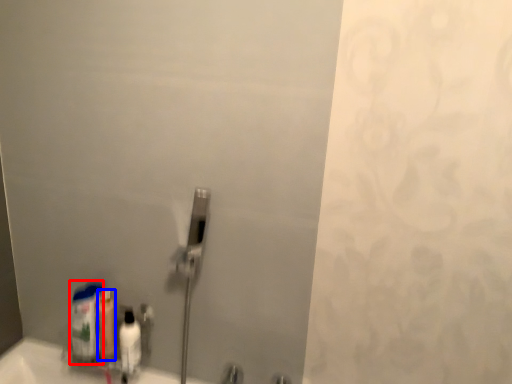
Question: Among these objects, which one is nearest to the camera, cleaning product (highlighted by a red box) or mouthwash (highlighted by a blue box)?

Choices:
 (A) cleaning product
 (B) mouthwash

Answer: (A)